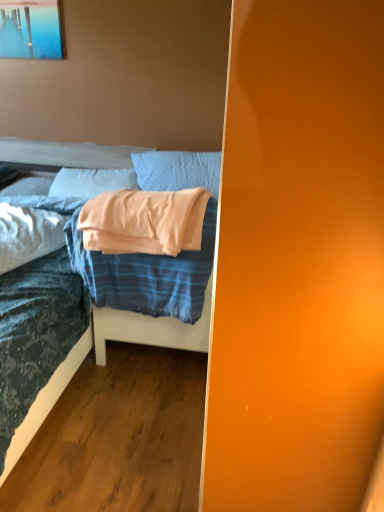
What is the approximate height of peach soft fabric pillow at center, the 2th pillow positioned from the back?

It is 6.95 inches.

The height and width of the screenshot is (512, 384). What do you see at coordinates (30, 29) in the screenshot?
I see `metallic glossy picture frame at upper left` at bounding box center [30, 29].

Describe the element at coordinates (177, 170) in the screenshot. The width and height of the screenshot is (384, 512). I see `light blue fabric pillow at upper center, the third pillow from the back` at that location.

Describe the element at coordinates (147, 275) in the screenshot. Image resolution: width=384 pixels, height=512 pixels. I see `blue striped fabric blanket at center` at that location.

You are a GUI agent. You are given a task and a screenshot of the screen. Output one action in this format:
    pyautogui.click(x=<x>, y=<y>)
    Task: Click on the white soft pillow at left, which is the 4th pillow from back to front
    
    Given the screenshot: What is the action you would take?
    pyautogui.click(x=28, y=234)

What do you see at coordinates (28, 187) in the screenshot? This screenshot has height=512, width=384. I see `white soft pillow at upper left, the 4th pillow positioned from the front` at bounding box center [28, 187].

This screenshot has width=384, height=512. In order to click on peach soft fabric pillow at center, the 2th pillow positioned from the back in this screenshot , I will do `click(91, 182)`.

From the image's perspective, is metallic glossy picture frame at upper left located above or below white soft pillow at upper left, the 4th pillow positioned from the front?

From the image's perspective, metallic glossy picture frame at upper left appears above white soft pillow at upper left, the 4th pillow positioned from the front.

Between metallic glossy picture frame at upper left and white soft pillow at upper left, arranged as the 1th pillow when viewed from the back, which one has larger size?

With larger size is white soft pillow at upper left, arranged as the 1th pillow when viewed from the back.

Is metallic glossy picture frame at upper left at the left side of white soft pillow at upper left, arranged as the 1th pillow when viewed from the back?

→ No, metallic glossy picture frame at upper left is not to the left of white soft pillow at upper left, arranged as the 1th pillow when viewed from the back.

Considering the points (23, 48) and (22, 188), which point is behind, point (23, 48) or point (22, 188)?

The point (22, 188) is farther.

Is the depth of blue striped fabric blanket at center greater than that of white soft pillow at left, arranged as the first pillow when viewed from the front?

No, it is not.

Find the location of a particular element. the 2nd pillow below the blue striped fabric blanket at center (from a real-world perspective) is located at coordinates (28, 234).

From a real-world perspective, which is physically above, blue striped fabric blanket at center or white soft pillow at left, which is the 4th pillow from back to front?

From a 3D spatial view, blue striped fabric blanket at center is above.

Which is nearer, (172, 263) or (35, 228)?

Point (172, 263) is positioned closer to the camera compared to point (35, 228).

From a real-world perspective, is metallic glossy picture frame at upper left physically located above or below blue striped fabric blanket at center?

Clearly, from a real-world perspective, metallic glossy picture frame at upper left is above blue striped fabric blanket at center.

Is metallic glossy picture frame at upper left directly adjacent to blue striped fabric blanket at center?

They are not placed beside each other.

Considering the relative sizes of metallic glossy picture frame at upper left and blue striped fabric blanket at center in the image provided, is metallic glossy picture frame at upper left thinner than blue striped fabric blanket at center?

Yes, metallic glossy picture frame at upper left is thinner than blue striped fabric blanket at center.

Which of these two, metallic glossy picture frame at upper left or blue striped fabric blanket at center, stands shorter?

metallic glossy picture frame at upper left.

Where is `blanket in front of the peach soft fabric pillow at center, the 3th pillow viewed from the front`? The image size is (384, 512). blanket in front of the peach soft fabric pillow at center, the 3th pillow viewed from the front is located at coordinates (147, 275).

Considering the relative sizes of peach soft fabric pillow at center, the 3th pillow viewed from the front, and blue striped fabric blanket at center in the image provided, is peach soft fabric pillow at center, the 3th pillow viewed from the front, shorter than blue striped fabric blanket at center?

Yes.

Is blue striped fabric blanket at center at the back of peach soft fabric pillow at center, the 2th pillow positioned from the back?

No.

Considering the points (197, 263) and (45, 221), which point is in front, point (197, 263) or point (45, 221)?

Positioned in front is point (197, 263).

Can you tell me how much blue plaid bed at lower left and white soft pillow at left, arranged as the first pillow when viewed from the front, differ in facing direction?

28.6 degrees separate the facing orientations of blue plaid bed at lower left and white soft pillow at left, arranged as the first pillow when viewed from the front.

Is blue plaid bed at lower left to the left of white soft pillow at left, arranged as the first pillow when viewed from the front, from the viewer's perspective?

Incorrect, blue plaid bed at lower left is not on the left side of white soft pillow at left, arranged as the first pillow when viewed from the front.

From the image's perspective, who appears lower, blue plaid bed at lower left or white soft pillow at left, arranged as the first pillow when viewed from the front?

From the image's view, blue plaid bed at lower left is below.

Starting from the peach soft fabric pillow at center, the 2th pillow positioned from the back, which pillow is the 2nd one to the left? Please provide its 2D coordinates.

[(28, 187)]

Is peach soft fabric pillow at center, the 2th pillow positioned from the back, aimed at white soft pillow at upper left, the 4th pillow positioned from the front?

No, peach soft fabric pillow at center, the 2th pillow positioned from the back, does not turn towards white soft pillow at upper left, the 4th pillow positioned from the front.

Does peach soft fabric pillow at center, the 3th pillow viewed from the front, come in front of white soft pillow at upper left, arranged as the 1th pillow when viewed from the back?

Yes, it is in front of white soft pillow at upper left, arranged as the 1th pillow when viewed from the back.

Which is in front, point (93, 191) or point (0, 192)?

Positioned in front is point (93, 191).

Are peach soft fabric pillow at center, the 3th pillow viewed from the front, and light blue fabric pillow at upper center, the third pillow from the back, beside each other?

peach soft fabric pillow at center, the 3th pillow viewed from the front, and light blue fabric pillow at upper center, the third pillow from the back, are clearly separated.

Can you confirm if peach soft fabric pillow at center, the 3th pillow viewed from the front, is positioned to the left of light blue fabric pillow at upper center, the third pillow from the back?

Indeed, peach soft fabric pillow at center, the 3th pillow viewed from the front, is positioned on the left side of light blue fabric pillow at upper center, the third pillow from the back.

Can you confirm if peach soft fabric pillow at center, the 2th pillow positioned from the back, is bigger than light blue fabric pillow at upper center, arranged as the second pillow when viewed from the front?

Incorrect, peach soft fabric pillow at center, the 2th pillow positioned from the back, is not larger than light blue fabric pillow at upper center, arranged as the second pillow when viewed from the front.

Does peach soft fabric pillow at center, the 3th pillow viewed from the front, turn towards light blue fabric pillow at upper center, arranged as the second pillow when viewed from the front?

No.

The width and height of the screenshot is (384, 512). What are the coordinates of `picture frame positioned vertically above the white soft pillow at upper left, the 4th pillow positioned from the front (from a real-world perspective)` in the screenshot? It's located at (30, 29).

Where is `blanket on the right of white soft pillow at left, which is the 4th pillow from back to front`? This screenshot has height=512, width=384. blanket on the right of white soft pillow at left, which is the 4th pillow from back to front is located at coordinates (147, 275).

When comparing their distances from blue plaid bed at lower left, does white soft pillow at left, arranged as the first pillow when viewed from the front, or metallic glossy picture frame at upper left seem further?

metallic glossy picture frame at upper left is further to blue plaid bed at lower left.

Which object lies further to the anchor point light blue fabric pillow at upper center, arranged as the second pillow when viewed from the front, peach soft fabric pillow at center, the 3th pillow viewed from the front, or white soft pillow at left, arranged as the first pillow when viewed from the front?

white soft pillow at left, arranged as the first pillow when viewed from the front, is positioned further to the anchor light blue fabric pillow at upper center, arranged as the second pillow when viewed from the front.

Which object lies nearer to the anchor point metallic glossy picture frame at upper left, light blue fabric pillow at upper center, the third pillow from the back, or white soft pillow at left, arranged as the first pillow when viewed from the front?

light blue fabric pillow at upper center, the third pillow from the back.

Looking at the image, which one is located closer to blue striped fabric blanket at center, blue plaid bed at lower left or metallic glossy picture frame at upper left?

blue plaid bed at lower left is positioned closer to the anchor blue striped fabric blanket at center.

Which object lies further to the anchor point peach soft fabric pillow at center, the 2th pillow positioned from the back, blue plaid bed at lower left or white soft pillow at upper left, arranged as the 1th pillow when viewed from the back?

Based on the image, blue plaid bed at lower left appears to be further to peach soft fabric pillow at center, the 2th pillow positioned from the back.

Which object lies nearer to the anchor point blue striped fabric blanket at center, peach soft fabric pillow at center, the 3th pillow viewed from the front, or blue plaid bed at lower left?

blue plaid bed at lower left is positioned closer to the anchor blue striped fabric blanket at center.

When comparing their distances from peach soft fabric pillow at center, the 2th pillow positioned from the back, does white soft pillow at left, which is the 4th pillow from back to front, or metallic glossy picture frame at upper left seem further?

metallic glossy picture frame at upper left is positioned further to the anchor peach soft fabric pillow at center, the 2th pillow positioned from the back.

When comparing their distances from blue striped fabric blanket at center, does metallic glossy picture frame at upper left or peach soft fabric pillow at center, the 3th pillow viewed from the front, seem further?

metallic glossy picture frame at upper left is further to blue striped fabric blanket at center.

Identify the location of picture frame situated between white soft pillow at upper left, arranged as the 1th pillow when viewed from the back, and light blue fabric pillow at upper center, arranged as the second pillow when viewed from the front, from left to right. (30, 29).

Where is `pillow between white soft pillow at left, arranged as the first pillow when viewed from the front, and peach soft fabric pillow at center, the 2th pillow positioned from the back, in the front-back direction`? Image resolution: width=384 pixels, height=512 pixels. pillow between white soft pillow at left, arranged as the first pillow when viewed from the front, and peach soft fabric pillow at center, the 2th pillow positioned from the back, in the front-back direction is located at coordinates (177, 170).

Identify the location of blanket between white soft pillow at left, which is the 4th pillow from back to front, and blue plaid bed at lower left vertically. The height and width of the screenshot is (512, 384). (147, 275).

The height and width of the screenshot is (512, 384). I want to click on blanket between metallic glossy picture frame at upper left and blue plaid bed at lower left in the vertical direction, so click(x=147, y=275).